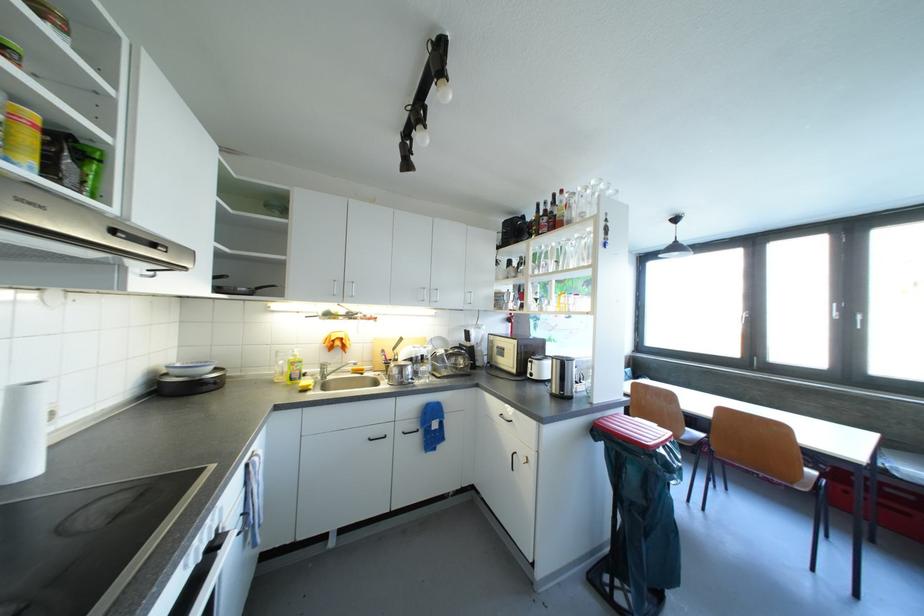
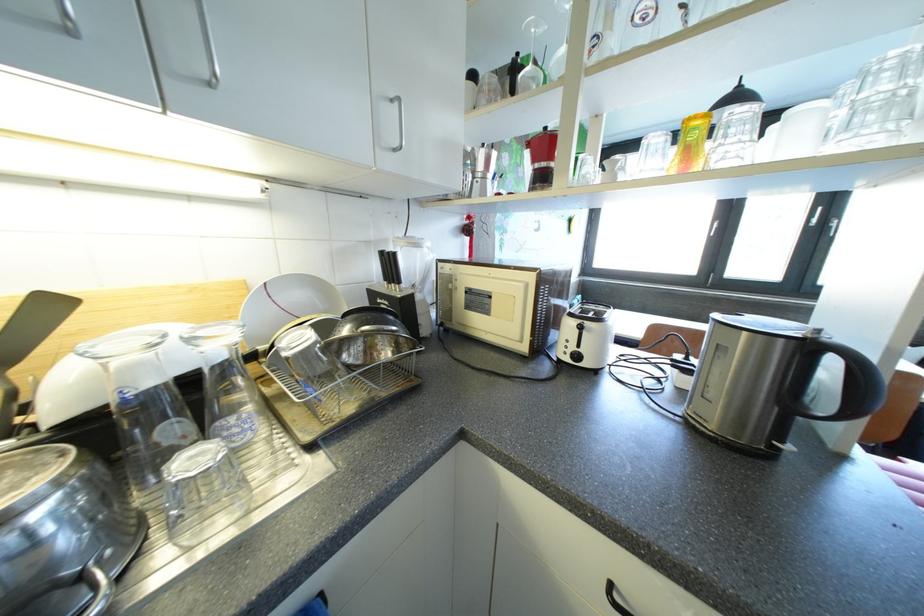
Locate, in the second image, the point that corresponds to (x=444, y=346) in the first image.

(300, 299)